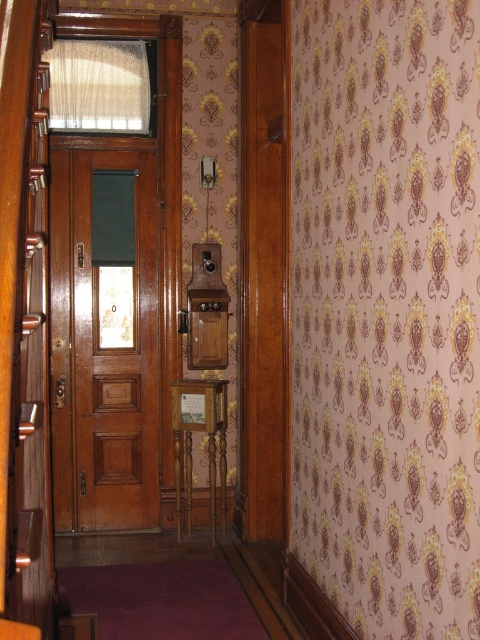
Question: Is wooden door at center above silky beige curtain at upper center?

Choices:
 (A) no
 (B) yes

Answer: (A)

Question: Is wooden door at center bigger than silky beige curtain at upper center?

Choices:
 (A) yes
 (B) no

Answer: (A)

Question: Can you confirm if wooden door at center is positioned below silky beige curtain at upper center?

Choices:
 (A) no
 (B) yes

Answer: (B)

Question: Which object appears closest to the camera in this image?

Choices:
 (A) silky beige curtain at upper center
 (B) wooden door at center

Answer: (A)

Question: Which point is farther to the camera?

Choices:
 (A) wooden door at center
 (B) silky beige curtain at upper center

Answer: (A)